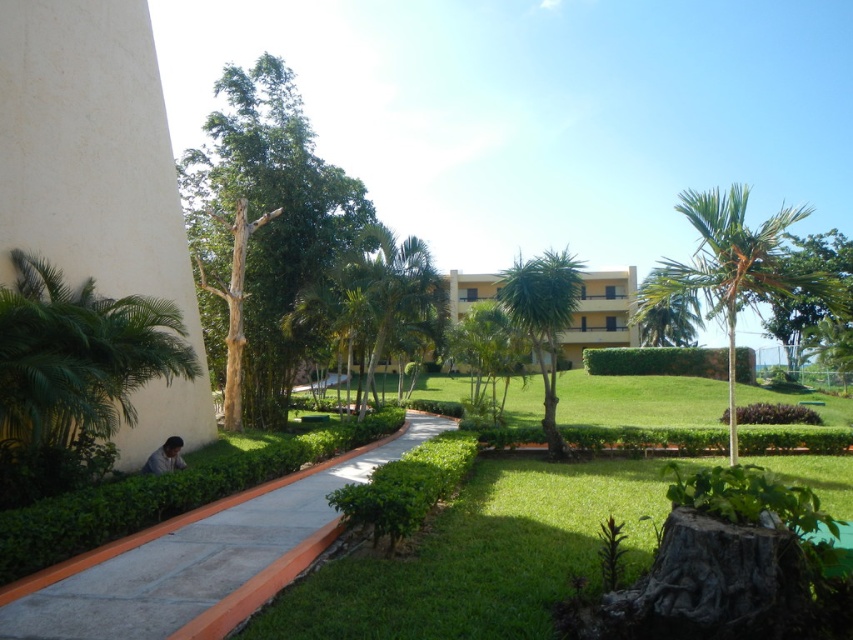
You are a guest staying at this resort and want to take a photo of the yellow matte building at center without any obstructions. Considering the green leafy tree at upper right, is there a position you can stand where the tree won not block the building?

The green leafy tree at upper right is in front of the yellow matte building at center, so standing behind the tree or moving to a position where the tree is between you and the building would block the view. To avoid obstruction, you should position yourself to the side of the tree or find a vantage point where the tree is not in line with the building.

You are standing at the center of the pathway in the image. There is a point marked at coordinates (262, 228). Which object in the scene is located at this point?

The green leafy tree at left is located at the point marked by coordinates (262, 228).